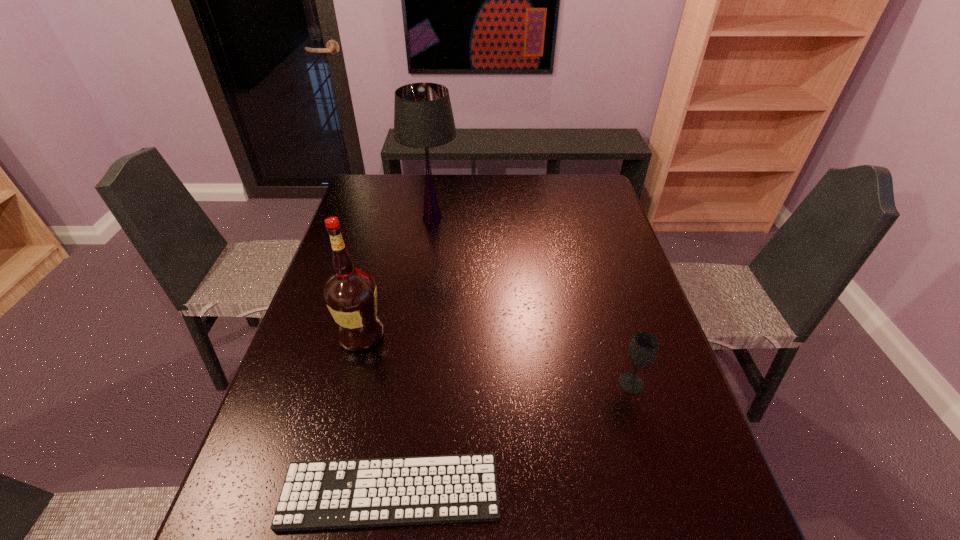
You are a GUI agent. You are given a task and a screenshot of the screen. Output one action in this format:
    pyautogui.click(x=<x>, y=<y>)
    Task: Click on the lampshade
    The image size is (960, 540).
    Given the screenshot: What is the action you would take?
    pyautogui.click(x=423, y=118)

In order to click on the tallest object in this screenshot , I will do click(x=423, y=118).

The width and height of the screenshot is (960, 540). Identify the location of the second tallest object. (350, 294).

Identify the location of alcohol. The image size is (960, 540). (350, 294).

Locate an element on the screen. This screenshot has width=960, height=540. wineglass is located at coordinates (643, 350).

You are a GUI agent. You are given a task and a screenshot of the screen. Output one action in this format:
    pyautogui.click(x=<x>, y=<y>)
    Task: Click on the rightmost object
    
    Given the screenshot: What is the action you would take?
    pyautogui.click(x=643, y=350)

This screenshot has width=960, height=540. I want to click on the nearest object, so click(355, 493).

I want to click on computer keyboard, so click(x=355, y=493).

You are a GUI agent. You are given a task and a screenshot of the screen. Output one action in this format:
    pyautogui.click(x=<x>, y=<y>)
    Task: Click on the free space located on the front-facing side of the tallest object
    
    Given the screenshot: What is the action you would take?
    pos(423,283)

I want to click on vacant point located 0.340m on the label of the third nearest object, so click(x=515, y=334).